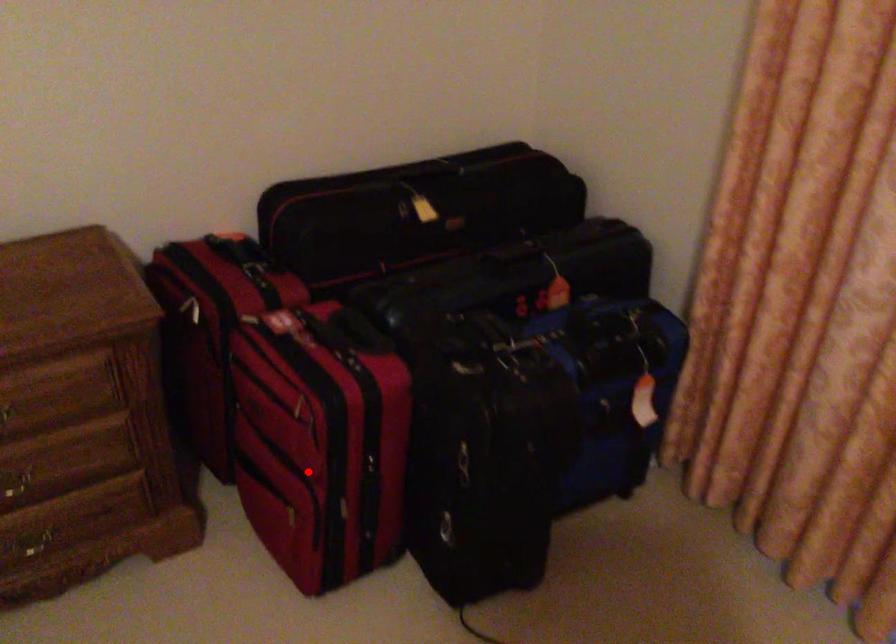
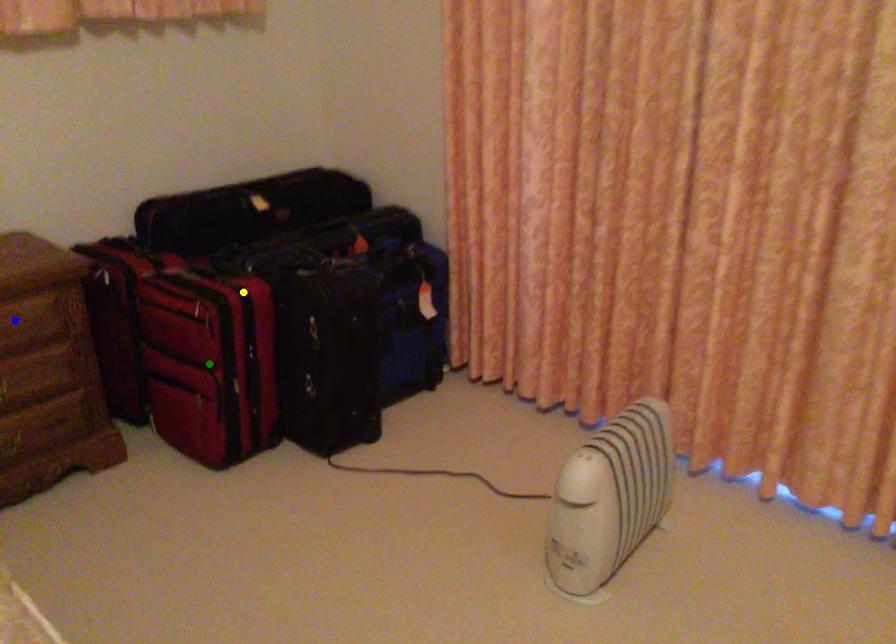
Question: I am providing you with two images of the same scene from different viewpoints. A red point is marked on the first image. You are given multiple points on the second image. Which point in image 2 is actually the same real-world point as the red point in image 1?

Choices:
 (A) yellow point
 (B) green point
 (C) blue point

Answer: (B)